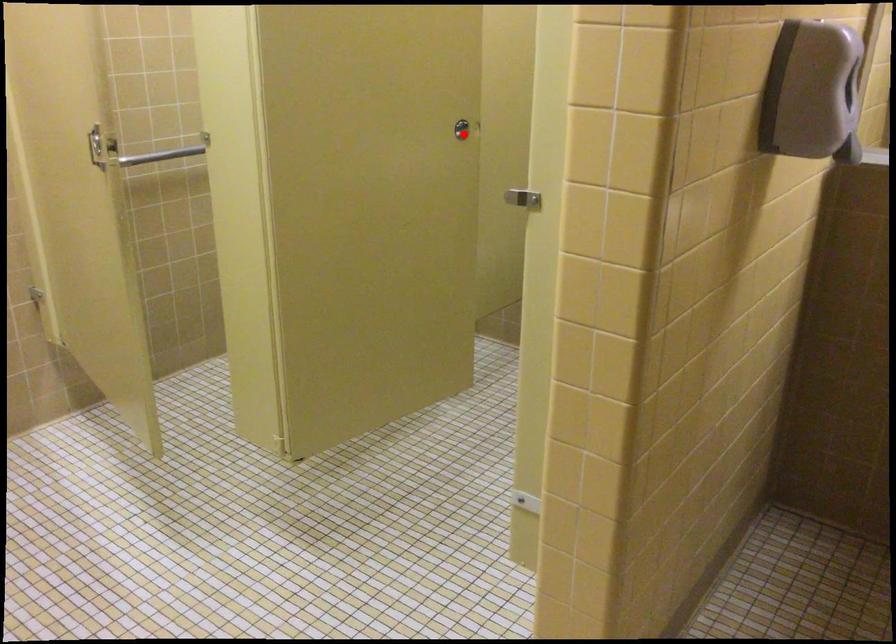
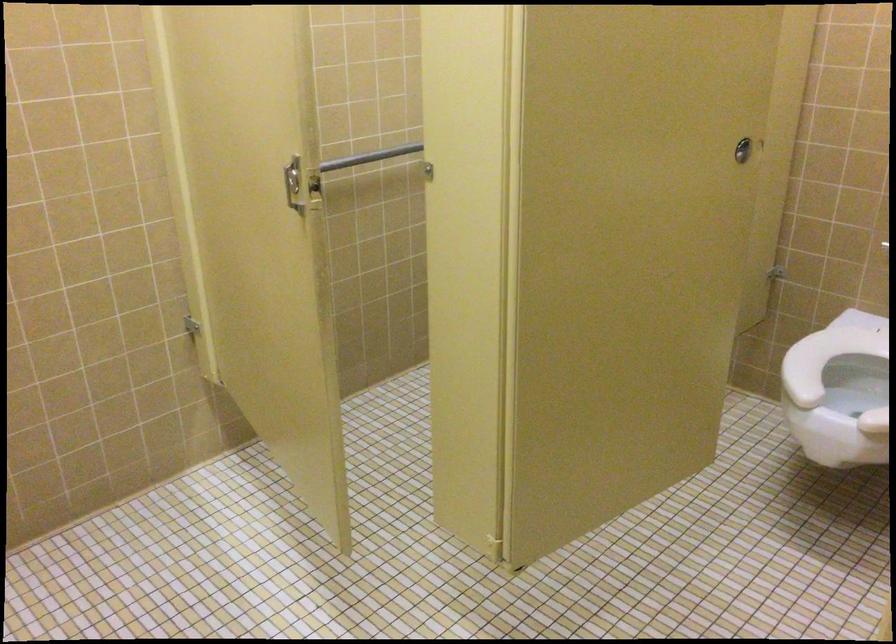
In the second image, find the point that corresponds to the highlighted location in the first image.

(743, 149)